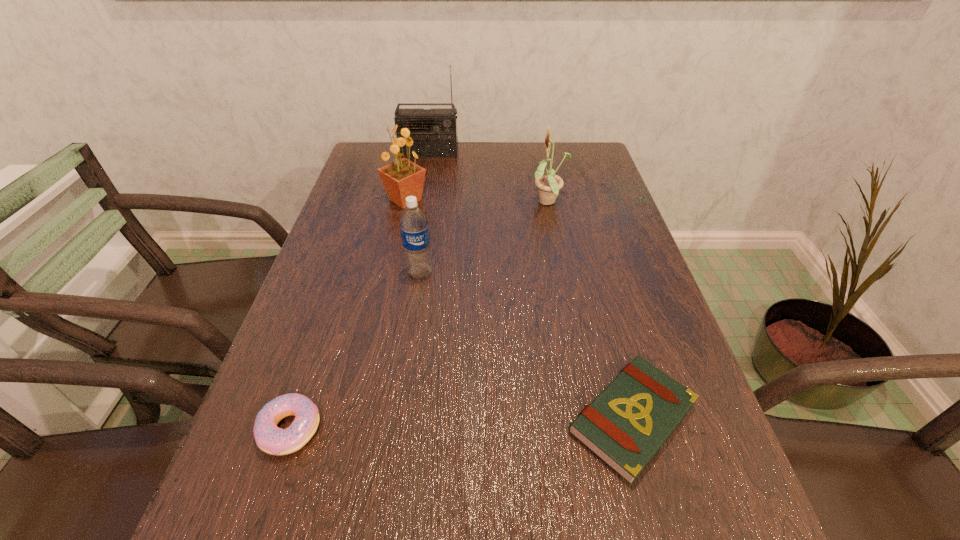
Where is `book that is at the right edge`? This screenshot has width=960, height=540. book that is at the right edge is located at coordinates (627, 423).

Locate an element on the screen. This screenshot has width=960, height=540. object situated at the far left corner is located at coordinates (435, 133).

Where is `vacant space at the far edge of the desktop`? This screenshot has width=960, height=540. vacant space at the far edge of the desktop is located at coordinates (492, 151).

The image size is (960, 540). What are the coordinates of `free spot at the left edge of the desktop` in the screenshot? It's located at (323, 454).

This screenshot has width=960, height=540. Find the location of `vacant space at the right edge of the desktop`. vacant space at the right edge of the desktop is located at coordinates (567, 188).

Identify the location of free spot at the far left corner of the desktop. This screenshot has height=540, width=960. 376,158.

Identify the location of vacant space that is in between the left sunflower and the book. Image resolution: width=960 pixels, height=540 pixels. (518, 309).

You are a GUI agent. You are given a task and a screenshot of the screen. Output one action in this format:
    pyautogui.click(x=<x>, y=<y>)
    Task: Click on the vacant space that's between the right sunflower and the second shortest object
    The width and height of the screenshot is (960, 540).
    Given the screenshot: What is the action you would take?
    pyautogui.click(x=420, y=316)

At what (x,y) coordinates should I click in order to perform the action: click on blank region between the fifth tallest object and the right sunflower. Please return your answer as a coordinate pair (x, y). Looking at the image, I should click on (420, 316).

Image resolution: width=960 pixels, height=540 pixels. I want to click on vacant space that's between the doughnut and the fourth farthest object, so click(355, 351).